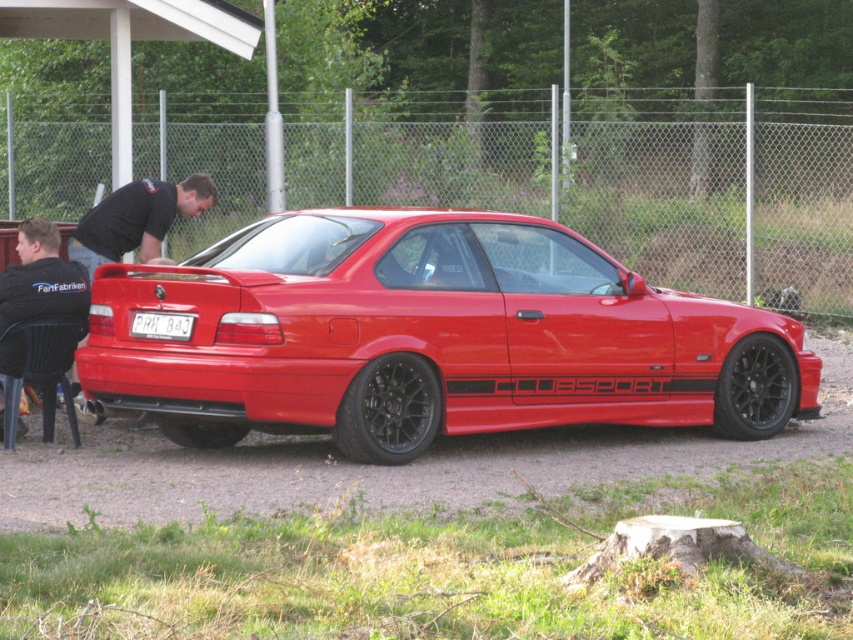
Can you confirm if glossy red sports car at center is thinner than white plastic license plate at center?

No.

Does glossy red sports car at center have a greater width compared to white plastic license plate at center?

Correct, the width of glossy red sports car at center exceeds that of white plastic license plate at center.

Locate an element on the screen. This screenshot has width=853, height=640. glossy red sports car at center is located at coordinates (415, 332).

Based on the photo, can you confirm if black matte tire at center is thinner than black fabric shirt at upper left?

Indeed, black matte tire at center has a lesser width compared to black fabric shirt at upper left.

Is black matte tire at center below black fabric shirt at upper left?

Indeed, black matte tire at center is positioned under black fabric shirt at upper left.

Who is more forward, (434, 429) or (160, 227)?

Point (434, 429)

Identify the location of black matte tire at center. This screenshot has width=853, height=640. (387, 410).

From the picture: Is black matte tire at center bigger than black matte tire at lower right?

No.

Does black matte tire at center have a lesser width compared to black matte tire at lower right?

Correct, black matte tire at center's width is less than black matte tire at lower right's.

Where is `black matte tire at center`? The image size is (853, 640). black matte tire at center is located at coordinates (387, 410).

Find the location of a particular element. The height and width of the screenshot is (640, 853). black matte tire at center is located at coordinates (387, 410).